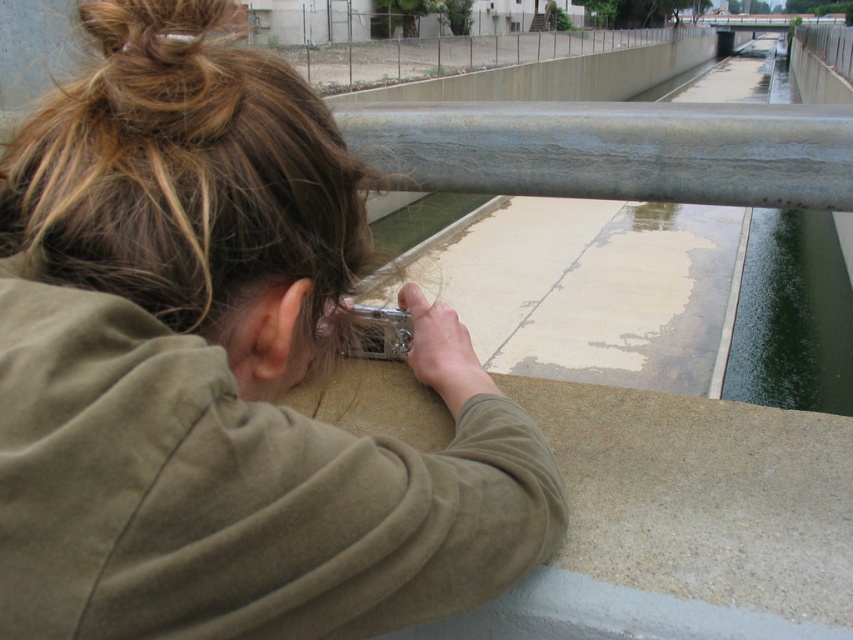
Question: Which of the following is the closest to the observer?

Choices:
 (A) 733,284
 (B) 277,600

Answer: (B)

Question: Considering the relative positions of brownhair at left and concrete fence at upper center in the image provided, where is brownhair at left located with respect to concrete fence at upper center?

Choices:
 (A) above
 (B) below

Answer: (B)

Question: Which of the following is the closest to the observer?

Choices:
 (A) (837, 250)
 (B) (514, 560)
 (C) (62, 211)

Answer: (C)

Question: Which of the following is the farthest from the observer?

Choices:
 (A) brownhair at left
 (B) concrete fence at upper center
 (C) matte silver camera at upper left
 (D) green smooth water at upper right

Answer: (B)

Question: Is matte silver camera at upper left smaller than green smooth water at upper right?

Choices:
 (A) yes
 (B) no

Answer: (A)

Question: Is matte silver camera at upper left smaller than brownhair at left?

Choices:
 (A) no
 (B) yes

Answer: (B)